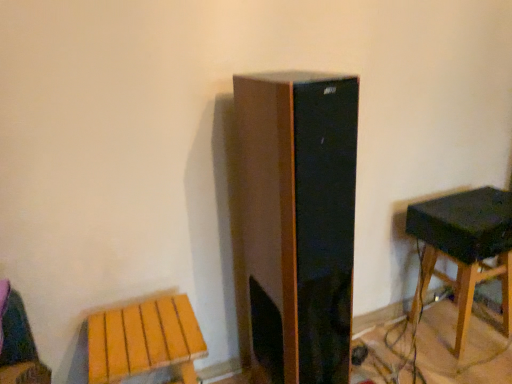
Question: Can you confirm if black matte speaker at right is smaller than wooden stool at lower left, which is counted as the 1th stool, starting from the left?

Choices:
 (A) no
 (B) yes

Answer: (B)

Question: Is black matte speaker at right positioned in front of wooden stool at lower left, which is the second stool in back-to-front order?

Choices:
 (A) no
 (B) yes

Answer: (A)

Question: Could wooden stool at lower left, which is the second stool in back-to-front order, be considered to be inside black matte speaker at right?

Choices:
 (A) no
 (B) yes

Answer: (A)

Question: Does black matte speaker at right appear on the right side of wooden stool at lower left, the 2th stool in the right-to-left sequence?

Choices:
 (A) yes
 (B) no

Answer: (A)

Question: Does black matte speaker at right have a greater width compared to wooden stool at lower left, which is counted as the 1th stool, starting from the left?

Choices:
 (A) yes
 (B) no

Answer: (B)

Question: From the image's perspective, relative to black matte speaker at right, is wooden stool at lower left, the first stool in the front-to-back sequence, above or below?

Choices:
 (A) below
 (B) above

Answer: (A)

Question: From a real-world perspective, is wooden stool at lower left, which is the second stool in back-to-front order, physically located above or below black matte speaker at right?

Choices:
 (A) above
 (B) below

Answer: (B)

Question: Considering the positions of wooden stool at lower left, which is the second stool in back-to-front order, and black matte speaker at right in the image, is wooden stool at lower left, which is the second stool in back-to-front order, bigger or smaller than black matte speaker at right?

Choices:
 (A) small
 (B) big

Answer: (B)

Question: Relative to black matte speaker at right, is wooden stool at lower left, the first stool in the front-to-back sequence, in front or behind?

Choices:
 (A) front
 (B) behind

Answer: (A)

Question: Looking at their shapes, would you say black matte speaker at right is wider or thinner than wooden stool at lower left, the 2th stool in the right-to-left sequence?

Choices:
 (A) wide
 (B) thin

Answer: (B)

Question: Based on their sizes in the image, would you say black matte speaker at right is bigger or smaller than wooden stool at lower left, which is counted as the 1th stool, starting from the left?

Choices:
 (A) big
 (B) small

Answer: (B)

Question: Would you say black matte speaker at right is to the left or to the right of wooden stool at lower left, which is counted as the 1th stool, starting from the left, in the picture?

Choices:
 (A) right
 (B) left

Answer: (A)

Question: Is black matte speaker at right in front of or behind wooden stool at lower left, which is the second stool in back-to-front order, in the image?

Choices:
 (A) front
 (B) behind

Answer: (B)

Question: Would you say black matte speaker at right is to the left or to the right of wooden stool at right, the 1th stool from the back, in the picture?

Choices:
 (A) left
 (B) right

Answer: (B)

Question: From the image's perspective, is black matte speaker at right positioned above or below wooden stool at right, which ranks as the 1th stool in right-to-left order?

Choices:
 (A) below
 (B) above

Answer: (B)